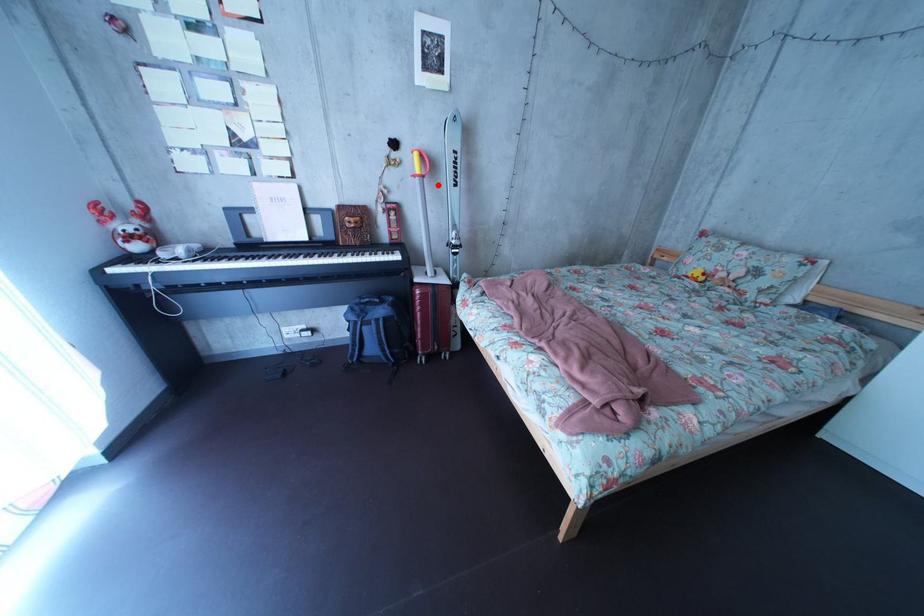
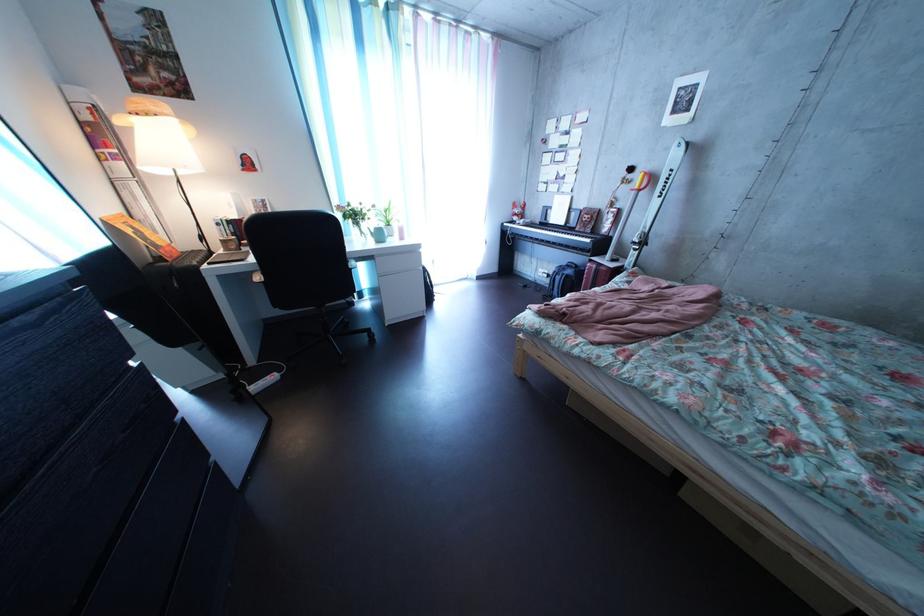
Locate, in the second image, the point that corresponds to the highlighted location in the first image.

(653, 199)